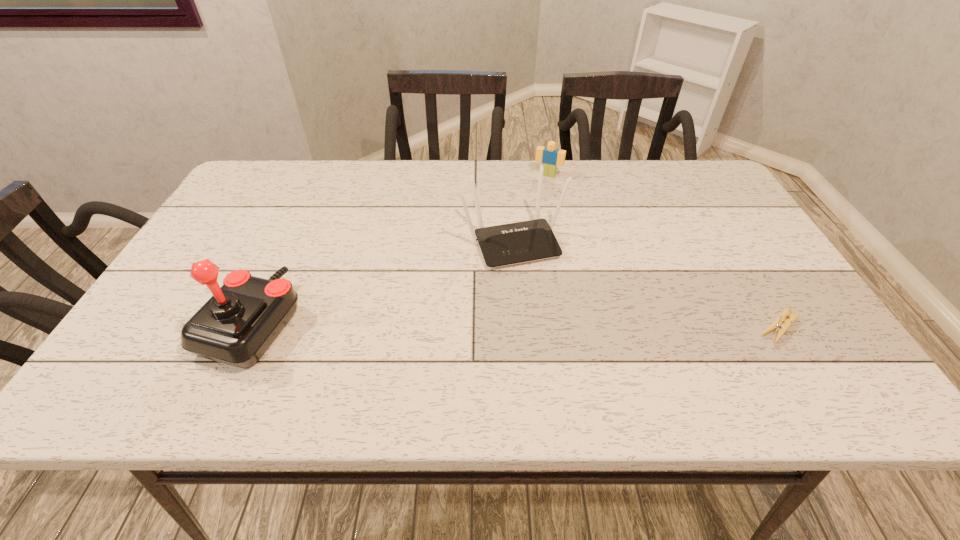
You are a GUI agent. You are given a task and a screenshot of the screen. Output one action in this format:
    pyautogui.click(x=<x>, y=<y>)
    Task: Click on the vacant space on the desktop that is between the leftmost object and the shortest object and is positioned on the front-facing side of the second tallest object
    
    Given the screenshot: What is the action you would take?
    pyautogui.click(x=552, y=326)

Where is `vacant space on the desktop that is between the joystick and the rightmost object and is positioned on the face of the farthest object`? The height and width of the screenshot is (540, 960). vacant space on the desktop that is between the joystick and the rightmost object and is positioned on the face of the farthest object is located at coordinates (478, 325).